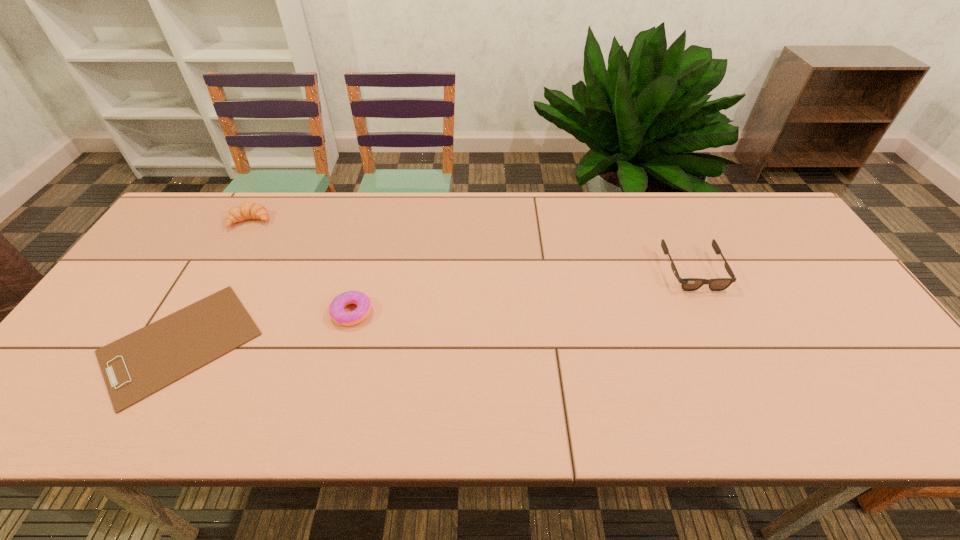
The image size is (960, 540). I want to click on crescent roll, so click(x=247, y=210).

The width and height of the screenshot is (960, 540). Find the location of `sunglasses`. sunglasses is located at coordinates (688, 284).

Identify the location of doughnut. This screenshot has height=540, width=960. (337, 313).

I want to click on the third tallest object, so click(337, 313).

Identify the location of clipboard. This screenshot has width=960, height=540. tap(134, 367).

Identify the location of vacant space situated 0.400m on the right of the crescent roll. Image resolution: width=960 pixels, height=540 pixels. (398, 221).

What are the coordinates of `vacant space located on the temples of the sunglasses` in the screenshot? It's located at (722, 333).

Where is `vacant region located 0.060m on the left of the third object from left to right`? The width and height of the screenshot is (960, 540). vacant region located 0.060m on the left of the third object from left to right is located at coordinates (307, 312).

Where is `blank area located 0.340m on the right of the clipboard`? The image size is (960, 540). blank area located 0.340m on the right of the clipboard is located at coordinates (399, 343).

Identify the location of object that is positioned at the far edge. (247, 210).